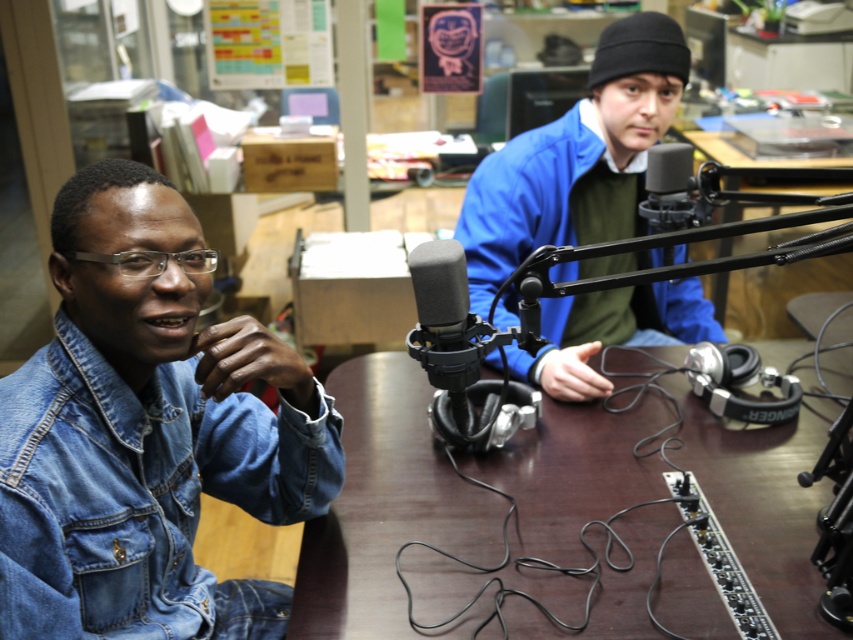
Question: Considering the relative positions of denim jacket at lower right and black matte microphone at center in the image provided, where is denim jacket at lower right located with respect to black matte microphone at center?

Choices:
 (A) left
 (B) right

Answer: (A)

Question: Which of the following is the closest to the observer?

Choices:
 (A) (498, 259)
 (B) (589, 636)

Answer: (B)

Question: Which point is farther from the camera taking this photo?

Choices:
 (A) (96, 477)
 (B) (422, 291)
 (C) (625, 419)
 (D) (596, 45)

Answer: (D)

Question: Which of the following is the farthest from the observer?

Choices:
 (A) blue denim jacket at center
 (B) brown wooden table at center

Answer: (A)

Question: Can you confirm if denim jacket at lower right is positioned to the right of black matte microphone at center?

Choices:
 (A) no
 (B) yes

Answer: (A)

Question: Can you confirm if brown wooden table at center is bigger than denim jacket at lower right?

Choices:
 (A) yes
 (B) no

Answer: (A)